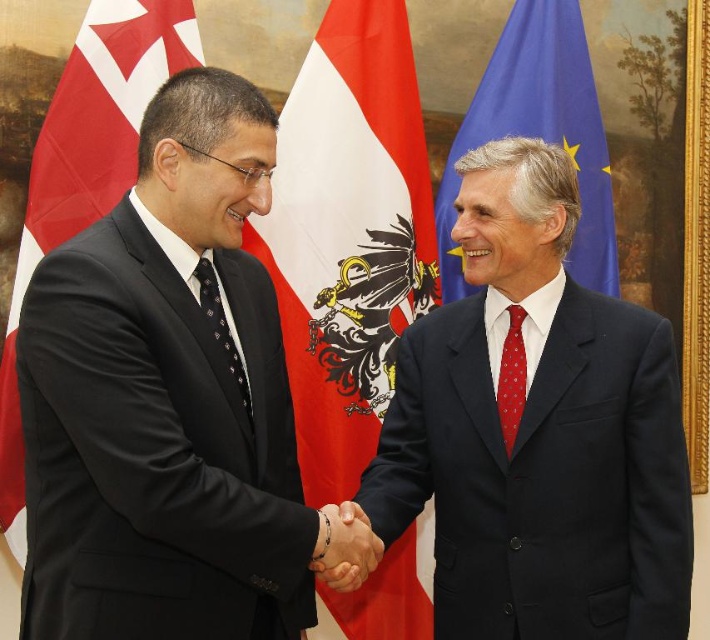
Question: Observing the image, what is the correct spatial positioning of smooth skin handshake at center in reference to red dotted fabric tie at center?

Choices:
 (A) left
 (B) right

Answer: (A)

Question: Which is farther from the blue fabric flag at upper right?

Choices:
 (A) red/white fabric flag at center
 (B) red fabric flag at left
 (C) dark blue suit at center

Answer: (B)

Question: Among these points, which one is nearest to the camera?

Choices:
 (A) 40,202
 (B) 393,538
 (C) 356,115
 (D) 524,387

Answer: (B)

Question: Does black matte suit at left appear on the left side of red dotted fabric tie at center?

Choices:
 (A) yes
 (B) no

Answer: (A)

Question: Which of these objects is positioned farthest from the blue fabric flag at upper right?

Choices:
 (A) dark blue suit at center
 (B) red/white fabric flag at center
 (C) red fabric flag at left

Answer: (C)

Question: Can you confirm if black matte suit at left is wider than dark blue suit at center?

Choices:
 (A) yes
 (B) no

Answer: (B)